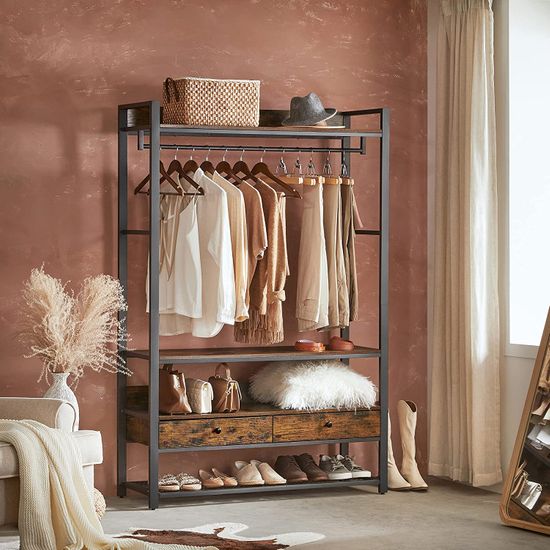
At what (x,y) coordinates should I click in order to perform the action: click on clothes on hangers. Please return your answer as a coordinate pair (x, y). Looking at the image, I should click on (350, 206), (335, 211), (311, 216), (282, 205), (269, 199), (251, 211), (236, 214), (222, 233), (189, 251).